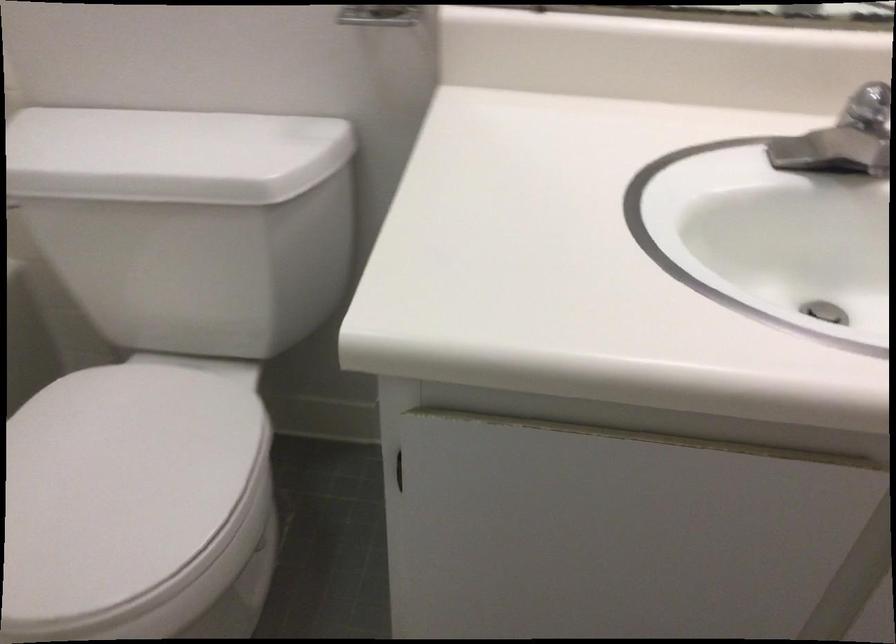
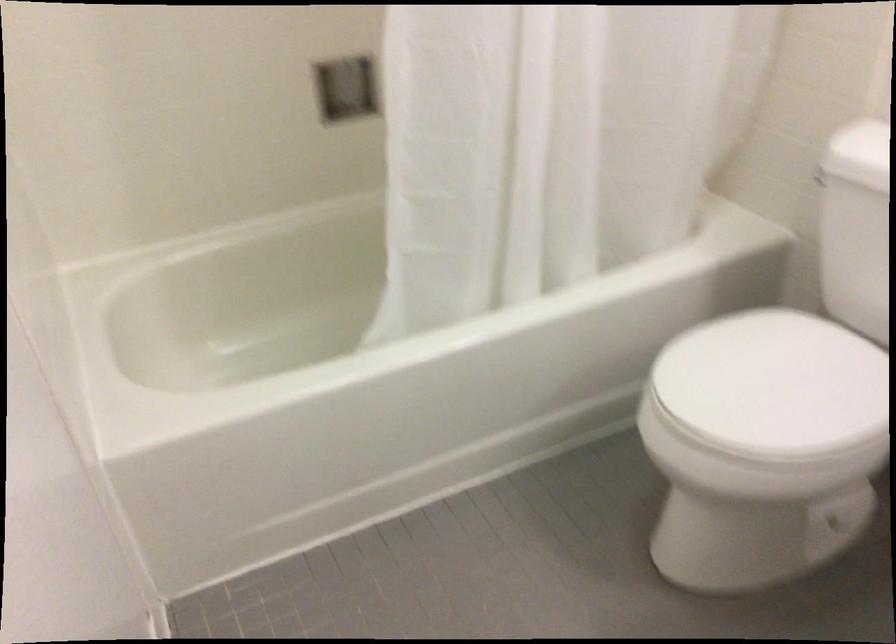
Question: The camera is either moving clockwise (left) or counter-clockwise (right) around the object. The first image is from the beginning of the video and the second image is from the end. Is the camera moving left or right when shooting the video?

Choices:
 (A) Left
 (B) Right

Answer: (B)